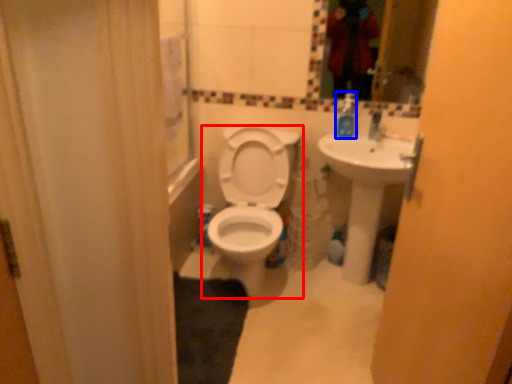
Question: Among these objects, which one is farthest to the camera, toilet (highlighted by a red box) or soap dispenser (highlighted by a blue box)?

Choices:
 (A) toilet
 (B) soap dispenser

Answer: (B)